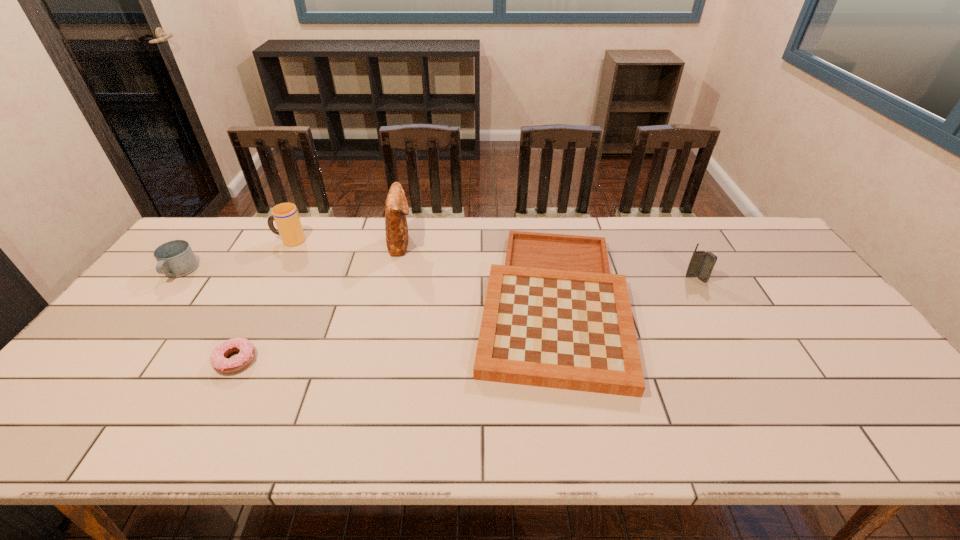
The height and width of the screenshot is (540, 960). I want to click on the tallest object, so click(x=396, y=208).

Locate an element on the screen. clutch bag is located at coordinates (396, 208).

Where is `cup`? cup is located at coordinates (285, 215).

You are a GUI agent. You are given a task and a screenshot of the screen. Output one action in this format:
    pyautogui.click(x=<x>, y=<y>)
    Task: Click on the rightmost object
    
    Given the screenshot: What is the action you would take?
    pyautogui.click(x=702, y=263)

Image resolution: width=960 pixels, height=540 pixels. Find the location of `the leftmost object`. the leftmost object is located at coordinates 176,258.

I want to click on mug, so click(x=176, y=258).

Find the location of a particular element. the fifth object from left to right is located at coordinates (554, 316).

Locate an element on the screen. This screenshot has width=960, height=540. doughnut is located at coordinates (220, 363).

Where is `free space located 0.110m on the open side of the clutch bag`? This screenshot has height=540, width=960. free space located 0.110m on the open side of the clutch bag is located at coordinates (446, 244).

You are a GUI agent. You are given a task and a screenshot of the screen. Output one action in this format:
    pyautogui.click(x=<x>, y=<y>)
    Task: Click on the vacant space located on the side of the cup with the handle
    
    Given the screenshot: What is the action you would take?
    pyautogui.click(x=250, y=240)